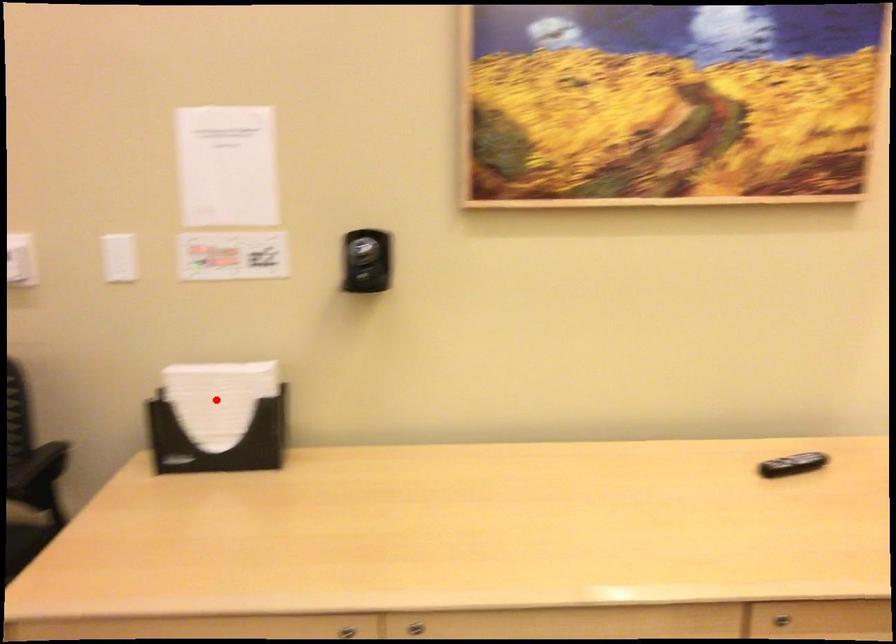
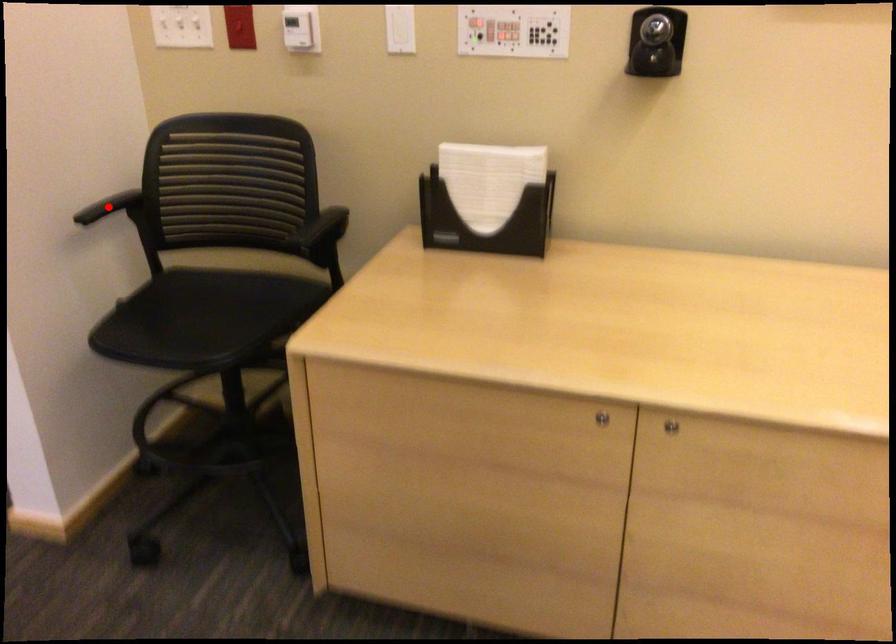
I am providing you with two images of the same scene from different viewpoints. A red point is marked on the first image and another point is marked on the second image. Does the point marked in image1 correspond to the same location as the one in image2?

No